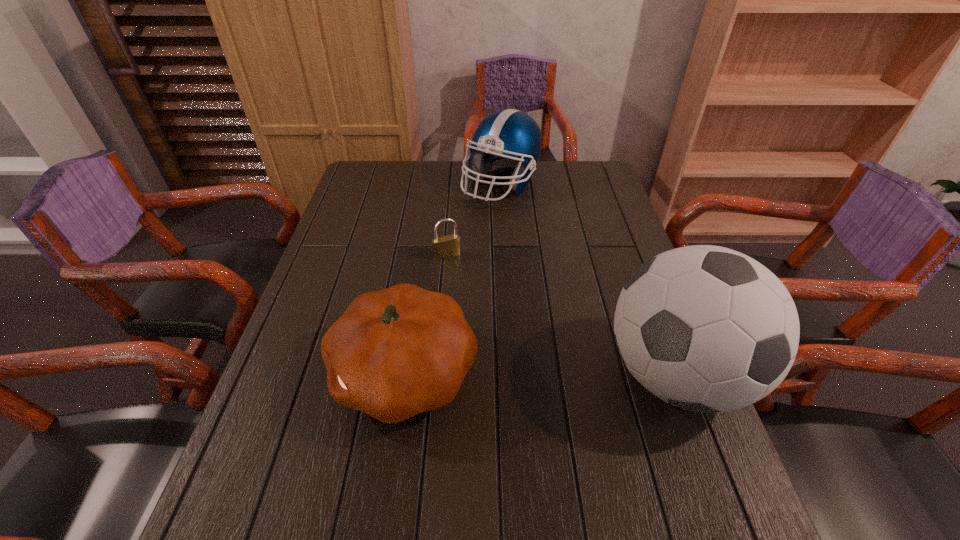
Find the location of a particular element. The height and width of the screenshot is (540, 960). free space between the tallest object and the second farthest object is located at coordinates (562, 315).

The height and width of the screenshot is (540, 960). Find the location of `free area in between the football helmet and the padlock`. free area in between the football helmet and the padlock is located at coordinates (474, 220).

The width and height of the screenshot is (960, 540). I want to click on free space between the third nearest object and the soccer ball, so click(562, 315).

Locate an element on the screen. object that is the third closest to the rightmost object is located at coordinates (508, 137).

Select which object appears as the third closest to the football helmet. Please provide its 2D coordinates. Your answer should be formatted as a tuple, i.e. [(x, y)], where the tuple contains the x and y coordinates of a point satisfying the conditions above.

[(705, 328)]

Where is `vacant space that satisfies the following two spatial constraints: 1. on the front side of the rightmost object; 2. on the right side of the football helmet`? The image size is (960, 540). vacant space that satisfies the following two spatial constraints: 1. on the front side of the rightmost object; 2. on the right side of the football helmet is located at coordinates (514, 375).